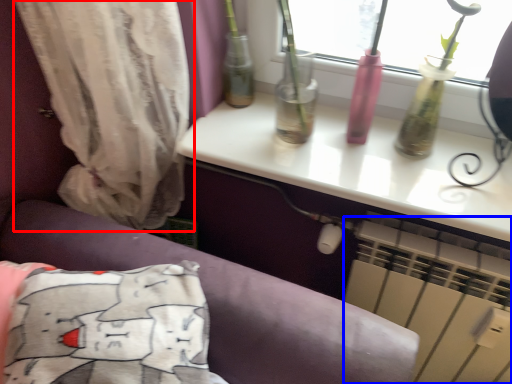
Question: Which object is further to the camera taking this photo, curtain (highlighted by a red box) or air conditioning (highlighted by a blue box)?

Choices:
 (A) curtain
 (B) air conditioning

Answer: (B)